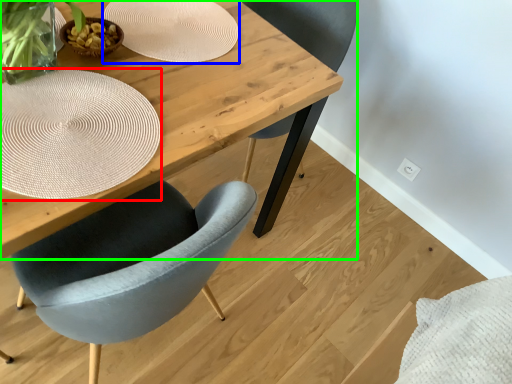
Question: Based on their relative distances, which object is nearer to paper plate (highlighted by a red box)? Choose from paper plate (highlighted by a blue box) and table (highlighted by a green box).

Choices:
 (A) paper plate
 (B) table

Answer: (B)